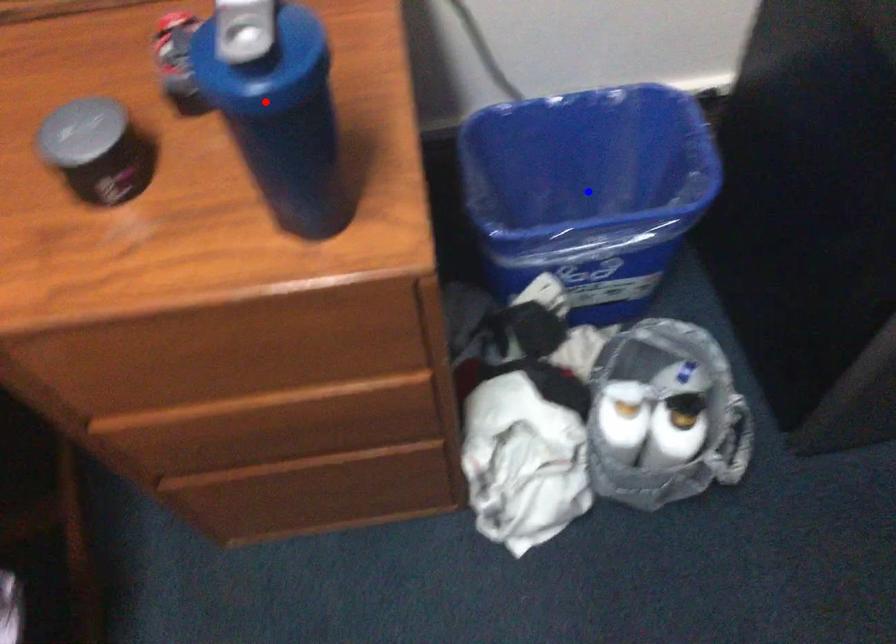
Question: In the image, two points are highlighted. Which point is nearer to the camera? Reply with the corresponding letter.

Choices:
 (A) blue point
 (B) red point

Answer: (B)